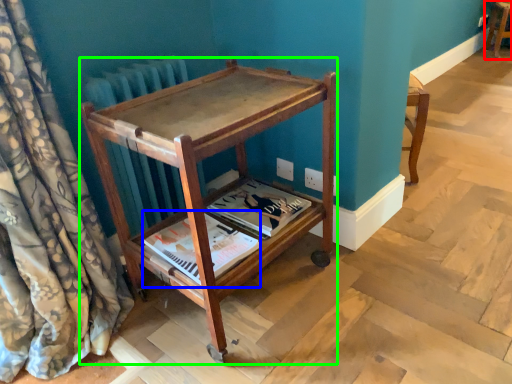
Question: Considering the real-world distances, which object is closest to furniture (highlighted by a red box)? magazine (highlighted by a blue box) or furniture (highlighted by a green box).

Choices:
 (A) magazine
 (B) furniture

Answer: (B)